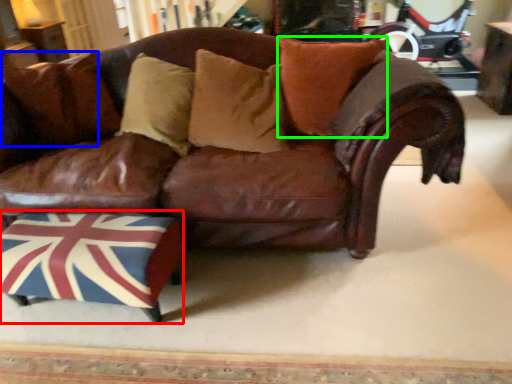
Question: Considering the real-world distances, which object is closest to swivel chair (highlighted by a red box)? pillow (highlighted by a blue box) or pillow (highlighted by a green box).

Choices:
 (A) pillow
 (B) pillow

Answer: (A)